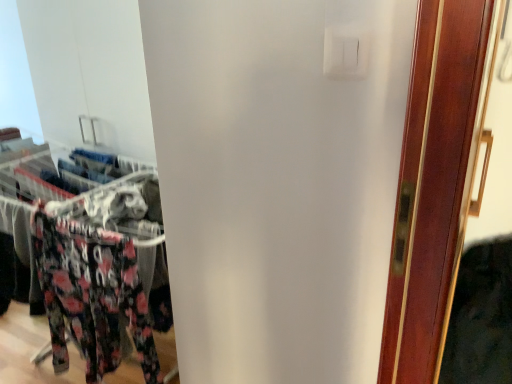
This screenshot has height=384, width=512. What do you see at coordinates (346, 52) in the screenshot?
I see `white plastic light switch at upper center` at bounding box center [346, 52].

This screenshot has height=384, width=512. What are the coordinates of `white plastic light switch at upper center` in the screenshot? It's located at (346, 52).

What is the approximate width of floral fabric pants at left?

It is 7.37 inches.

Measure the distance between point (x=18, y=207) and camera.

Point (x=18, y=207) is 5.00 feet away from camera.

Where is `floral fabric pants at left`? floral fabric pants at left is located at coordinates (24, 201).

The height and width of the screenshot is (384, 512). Describe the element at coordinates (24, 201) in the screenshot. I see `floral fabric pants at left` at that location.

I want to click on white plastic light switch at upper center, so [346, 52].

Considering the relative positions of white plastic light switch at upper center and floral fabric pants at left in the image provided, is white plastic light switch at upper center to the left of floral fabric pants at left from the viewer's perspective?

No.

Which object is further away from the camera taking this photo, white plastic light switch at upper center or floral fabric pants at left?

floral fabric pants at left is further away from the camera.

Does point (364, 40) come behind point (4, 221)?

No, (364, 40) is in front of (4, 221).

From the image's perspective, who appears lower, white plastic light switch at upper center or floral fabric pants at left?

From the image's view, floral fabric pants at left is below.

From a real-world perspective, which object stands above the other?

In real-world perspective, white plastic light switch at upper center is above.

Looking at this image, is white plastic light switch at upper center thinner than floral fabric pants at left?

Indeed, white plastic light switch at upper center has a lesser width compared to floral fabric pants at left.

Considering the relative sizes of white plastic light switch at upper center and floral fabric pants at left in the image provided, is white plastic light switch at upper center shorter than floral fabric pants at left?

Yes.

Considering the sizes of objects white plastic light switch at upper center and floral fabric pants at left in the image provided, who is smaller, white plastic light switch at upper center or floral fabric pants at left?

Smaller between the two is white plastic light switch at upper center.

Does white plastic light switch at upper center contain floral fabric pants at left?

Definitely not — floral fabric pants at left is not inside white plastic light switch at upper center.

In the scene shown: Is white plastic light switch at upper center not close to floral fabric pants at left?

Absolutely, white plastic light switch at upper center is distant from floral fabric pants at left.

Is white plastic light switch at upper center aimed at floral fabric pants at left?

No.

This screenshot has width=512, height=384. Identify the location of light switch above the floral fabric pants at left (from the image's perspective). (346, 52).

Is floral fabric pants at left to the left of white plastic light switch at upper center from the viewer's perspective?

Yes, floral fabric pants at left is to the left of white plastic light switch at upper center.

Is the position of floral fabric pants at left more distant than that of white plastic light switch at upper center?

Yes, floral fabric pants at left is further from the camera.

Considering the points (42, 146) and (360, 32), which point is in front, point (42, 146) or point (360, 32)?

The point (360, 32) is in front.

From the image's perspective, relative to white plastic light switch at upper center, is floral fabric pants at left above or below?

From the image's perspective, floral fabric pants at left appears below white plastic light switch at upper center.

From a real-world perspective, which object stands above the other?

white plastic light switch at upper center is physically above.

Which object is thinner, floral fabric pants at left or white plastic light switch at upper center?

white plastic light switch at upper center.

Does floral fabric pants at left have a lesser height compared to white plastic light switch at upper center?

No, floral fabric pants at left is not shorter than white plastic light switch at upper center.

Is floral fabric pants at left smaller than white plastic light switch at upper center?

Incorrect, floral fabric pants at left is not smaller in size than white plastic light switch at upper center.

Could white plastic light switch at upper center be considered to be inside floral fabric pants at left?

No, floral fabric pants at left does not contain white plastic light switch at upper center.

Is floral fabric pants at left far from white plastic light switch at upper center?

Yes, floral fabric pants at left is far from white plastic light switch at upper center.

Is white plastic light switch at upper center at the back of floral fabric pants at left?

floral fabric pants at left does not have its back to white plastic light switch at upper center.

Can you tell me how much floral fabric pants at left and white plastic light switch at upper center differ in facing direction?

The facing directions of floral fabric pants at left and white plastic light switch at upper center are 0.989 degrees apart.

Find the location of `light switch above the floral fabric pants at left (from the image's perspective)`. light switch above the floral fabric pants at left (from the image's perspective) is located at coordinates (346, 52).

Find the location of a particular element. light switch above the floral fabric pants at left (from a real-world perspective) is located at coordinates click(346, 52).

Locate an element on the screen. closet lying on the left of white plastic light switch at upper center is located at coordinates (24, 201).